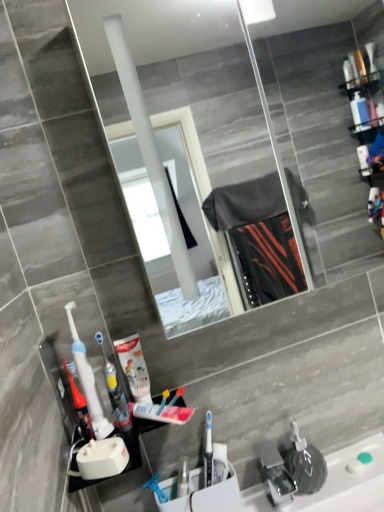
How much space does clear plastic sink at lower right, arranged as the first sink when viewed from the right, occupy vertically?

The height of clear plastic sink at lower right, arranged as the first sink when viewed from the right, is 6.18 inches.

The width and height of the screenshot is (384, 512). What do you see at coordinates (88, 381) in the screenshot? I see `translucent plastic toothbrush at left, the 1th toothbrush in the left-to-right sequence` at bounding box center [88, 381].

This screenshot has height=512, width=384. Identify the location of white plastic toothbrush holder at lower center, which is counted as the second sink, starting from the right. tap(202, 494).

The image size is (384, 512). What do you see at coordinates (196, 151) in the screenshot?
I see `transparent glass mirror at upper center` at bounding box center [196, 151].

Where is `clear plastic sink at lower right, marked as the 2th sink in a left-to-right arrangement`? clear plastic sink at lower right, marked as the 2th sink in a left-to-right arrangement is located at coordinates (292, 468).

From the picture: Can you confirm if white glossy toothpaste tube at center is positioned to the right of translucent plastic toothbrush at left, placed as the 2th toothbrush when sorted from right to left?

Indeed, white glossy toothpaste tube at center is positioned on the right side of translucent plastic toothbrush at left, placed as the 2th toothbrush when sorted from right to left.

Do you think white glossy toothpaste tube at center is within translucent plastic toothbrush at left, placed as the 2th toothbrush when sorted from right to left, or outside of it?

white glossy toothpaste tube at center is not enclosed by translucent plastic toothbrush at left, placed as the 2th toothbrush when sorted from right to left.

From the white glossy toothpaste tube at center, count the 2nd toothbrush to the left and point to it. Please provide its 2D coordinates.

[(88, 381)]

Based on the photo, from a real-world perspective, which object rests below the other?

white glossy toothpaste tube at center.

Is transparent glass mirror at upper center wider or thinner than translucent plastic mouthwash at lower left?

transparent glass mirror at upper center is wider than translucent plastic mouthwash at lower left.

From a real-world perspective, is transparent glass mirror at upper center on translucent plastic mouthwash at lower left?

Yes.

Is transparent glass mirror at upper center taller than translucent plastic mouthwash at lower left?

Yes.

Is translucent plastic mouthwash at lower left completely or partially inside transparent glass mirror at upper center?

No, translucent plastic mouthwash at lower left is located outside of transparent glass mirror at upper center.

From a real-world perspective, is white glossy toothpaste tube at center physically above white plastic toothbrush holder at lower center, the first sink from the left?

Yes, from a real-world perspective, white glossy toothpaste tube at center is above white plastic toothbrush holder at lower center, the first sink from the left.

Is white glossy toothpaste tube at center facing away from white plastic toothbrush holder at lower center, the first sink from the left?

No, white plastic toothbrush holder at lower center, the first sink from the left, is not at the back of white glossy toothpaste tube at center.

Are white glossy toothpaste tube at center and white plastic toothbrush holder at lower center, the first sink from the left, beside each other?

They are not placed beside each other.

Who is more distant, white glossy toothpaste tube at center or white plastic toothbrush holder at lower center, the first sink from the left?

white plastic toothbrush holder at lower center, the first sink from the left, is behind.

Is clear plastic sink at lower right, arranged as the first sink when viewed from the right, looking in the opposite direction of white plastic toothbrush holder at lower center, the first sink from the left?

No, clear plastic sink at lower right, arranged as the first sink when viewed from the right,'s orientation is not away from white plastic toothbrush holder at lower center, the first sink from the left.

From the image's perspective, which is above, clear plastic sink at lower right, arranged as the first sink when viewed from the right, or white plastic toothbrush holder at lower center, the first sink from the left?

clear plastic sink at lower right, arranged as the first sink when viewed from the right.

Where is `sink behind the white plastic toothbrush holder at lower center, which is counted as the second sink, starting from the right`? The width and height of the screenshot is (384, 512). sink behind the white plastic toothbrush holder at lower center, which is counted as the second sink, starting from the right is located at coordinates point(292,468).

Measure the distance between translucent plastic mouthwash at lower left and white glossy toothpaste tube at center.

translucent plastic mouthwash at lower left is 4.45 inches from white glossy toothpaste tube at center.

Identify the location of cleaning product below the translucent plastic mouthwash at lower left (from a real-world perspective). (134, 367).

Does translucent plastic mouthwash at lower left come in front of white glossy toothpaste tube at center?

Yes.

Is translucent plastic mouthwash at lower left facing towards white glossy toothpaste tube at center?

No, translucent plastic mouthwash at lower left is not oriented towards white glossy toothpaste tube at center.

Between white plastic toothbrush holder at lower center, the first sink from the left, and transparent glass mirror at upper center, which one has larger size?

transparent glass mirror at upper center.

Where is `mirror above the white plastic toothbrush holder at lower center, which is counted as the second sink, starting from the right (from the image's perspective)`? The width and height of the screenshot is (384, 512). mirror above the white plastic toothbrush holder at lower center, which is counted as the second sink, starting from the right (from the image's perspective) is located at coordinates (196, 151).

Which is more to the left, white plastic toothbrush at center, arranged as the 1th toothbrush when viewed from the right, or white glossy toothpaste tube at center?

white plastic toothbrush at center, arranged as the 1th toothbrush when viewed from the right.

Is white glossy toothpaste tube at center surrounded by white plastic toothbrush at center, arranged as the 1th toothbrush when viewed from the right?

No, white glossy toothpaste tube at center is not a part of white plastic toothbrush at center, arranged as the 1th toothbrush when viewed from the right.

From the picture: Considering the relative sizes of white plastic toothbrush at center, arranged as the 1th toothbrush when viewed from the right, and white glossy toothpaste tube at center in the image provided, is white plastic toothbrush at center, arranged as the 1th toothbrush when viewed from the right, bigger than white glossy toothpaste tube at center?

No.

Does white plastic toothbrush at center, which appears as the 2th toothbrush when viewed from the left, have a lesser width compared to white glossy toothpaste tube at center?

In fact, white plastic toothbrush at center, which appears as the 2th toothbrush when viewed from the left, might be wider than white glossy toothpaste tube at center.

This screenshot has height=512, width=384. In order to click on cleaning product on the right of translucent plastic toothbrush at left, placed as the 2th toothbrush when sorted from right to left in this screenshot , I will do `click(134, 367)`.

The width and height of the screenshot is (384, 512). What are the coordinates of `mirror above the translucent plastic mouthwash at lower left (from a real-world perspective)` in the screenshot? It's located at (196, 151).

Estimate the real-world distances between objects in this image. Which object is further from white plastic toothbrush holder at lower center, which is counted as the second sink, starting from the right, transparent glass mirror at upper center or white plastic toothbrush at center, arranged as the 1th toothbrush when viewed from the right?

Based on the image, transparent glass mirror at upper center appears to be further to white plastic toothbrush holder at lower center, which is counted as the second sink, starting from the right.

From the image, which object appears to be farther from white plastic toothbrush holder at lower center, the first sink from the left, white plastic toothbrush at center, arranged as the 1th toothbrush when viewed from the right, or clear plastic sink at lower right, marked as the 2th sink in a left-to-right arrangement?

The object further to white plastic toothbrush holder at lower center, the first sink from the left, is white plastic toothbrush at center, arranged as the 1th toothbrush when viewed from the right.

Looking at this image, based on their spatial positions, is translucent plastic mouthwash at lower left or white plastic toothbrush at center, arranged as the 1th toothbrush when viewed from the right, closer to transparent glass mirror at upper center?

The object closer to transparent glass mirror at upper center is white plastic toothbrush at center, arranged as the 1th toothbrush when viewed from the right.

Estimate the real-world distances between objects in this image. Which object is closer to translucent plastic mouthwash at lower left, white glossy toothpaste tube at center or white plastic toothbrush holder at lower center, the first sink from the left?

Based on the image, white glossy toothpaste tube at center appears to be nearer to translucent plastic mouthwash at lower left.

When comparing their distances from clear plastic sink at lower right, marked as the 2th sink in a left-to-right arrangement, does white plastic toothbrush at center, which appears as the 2th toothbrush when viewed from the left, or translucent plastic toothbrush at left, the 1th toothbrush in the left-to-right sequence, seem closer?

white plastic toothbrush at center, which appears as the 2th toothbrush when viewed from the left, lies closer to clear plastic sink at lower right, marked as the 2th sink in a left-to-right arrangement, than the other object.

Looking at the image, which one is located further to white plastic toothbrush at center, which appears as the 2th toothbrush when viewed from the left, translucent plastic toothbrush at left, the 1th toothbrush in the left-to-right sequence, or transparent glass mirror at upper center?

transparent glass mirror at upper center is further to white plastic toothbrush at center, which appears as the 2th toothbrush when viewed from the left.

When comparing their distances from white glossy toothpaste tube at center, does transparent glass mirror at upper center or translucent plastic toothbrush at left, the 1th toothbrush in the left-to-right sequence, seem closer?

translucent plastic toothbrush at left, the 1th toothbrush in the left-to-right sequence, lies closer to white glossy toothpaste tube at center than the other object.

Looking at the image, which one is located further to white glossy toothpaste tube at center, translucent plastic toothbrush at left, the 1th toothbrush in the left-to-right sequence, or white plastic toothbrush at center, which appears as the 2th toothbrush when viewed from the left?

The object further to white glossy toothpaste tube at center is translucent plastic toothbrush at left, the 1th toothbrush in the left-to-right sequence.

Where is `cleaning product between translucent plastic toothbrush at left, placed as the 2th toothbrush when sorted from right to left, and clear plastic sink at lower right, arranged as the first sink when viewed from the right, from left to right`? This screenshot has height=512, width=384. cleaning product between translucent plastic toothbrush at left, placed as the 2th toothbrush when sorted from right to left, and clear plastic sink at lower right, arranged as the first sink when viewed from the right, from left to right is located at coordinates (134, 367).

Where is `sink located between translucent plastic toothbrush at left, the 1th toothbrush in the left-to-right sequence, and clear plastic sink at lower right, arranged as the first sink when viewed from the right, in the left-right direction`? sink located between translucent plastic toothbrush at left, the 1th toothbrush in the left-to-right sequence, and clear plastic sink at lower right, arranged as the first sink when viewed from the right, in the left-right direction is located at coordinates (202, 494).

What are the coordinates of `mouthwash situated between translucent plastic toothbrush at left, placed as the 2th toothbrush when sorted from right to left, and white plastic toothbrush at center, which appears as the 2th toothbrush when viewed from the left, from left to right` in the screenshot? It's located at (80, 408).

The width and height of the screenshot is (384, 512). What are the coordinates of `toothbrush between translucent plastic toothbrush at left, placed as the 2th toothbrush when sorted from right to left, and white plastic toothbrush holder at lower center, the first sink from the left, in the vertical direction` in the screenshot? It's located at (115, 391).